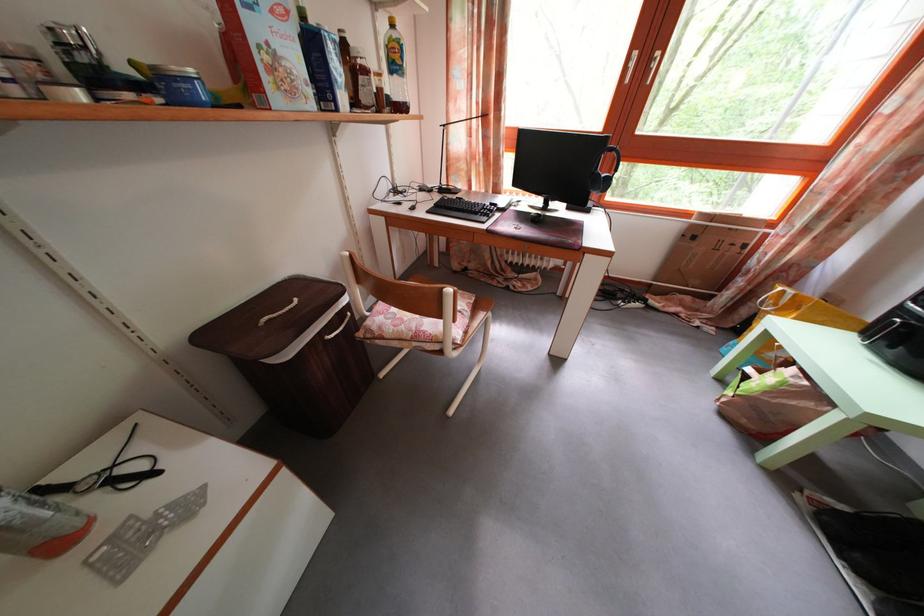
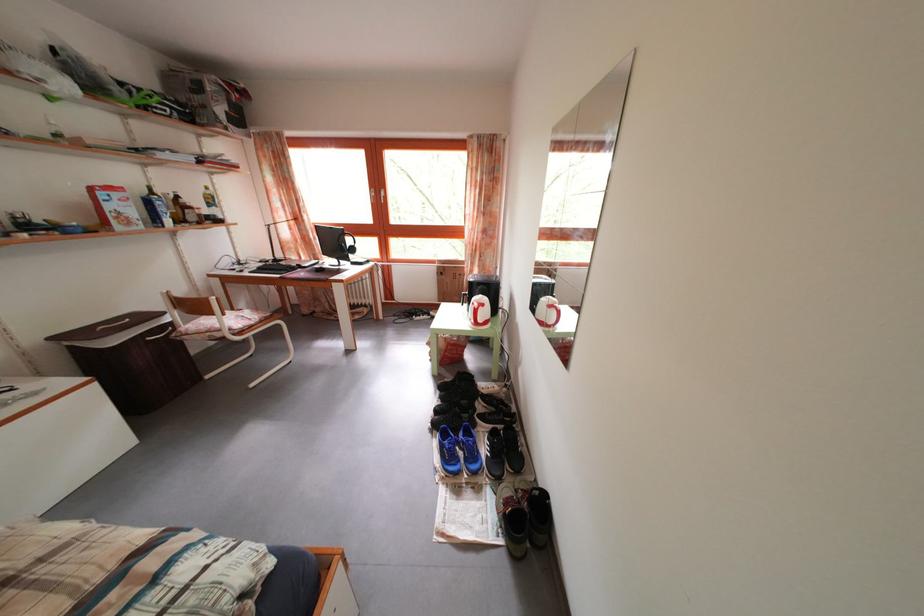
What movement of the cameraman would produce the second image?

The movement direction of the cameraman is right, backward.